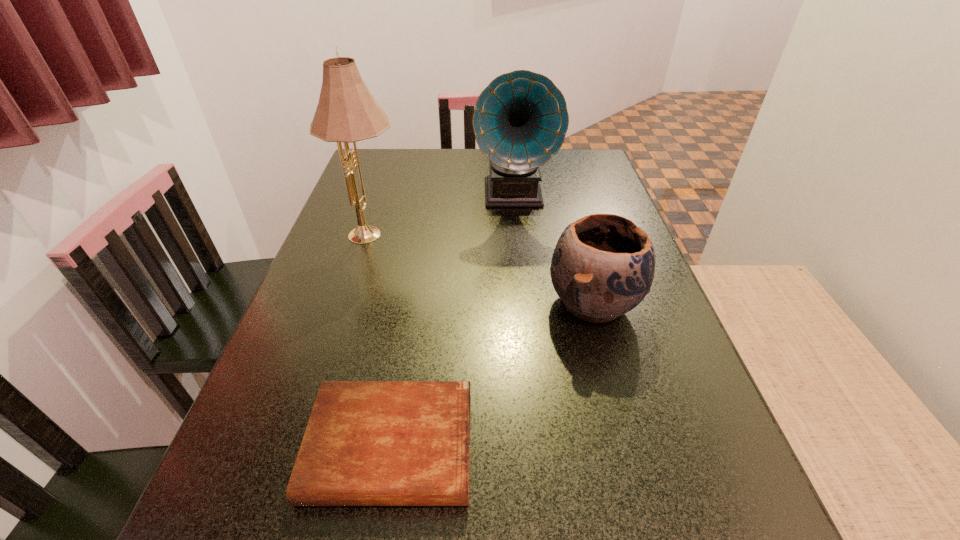
Identify the location of free space that satisfies the following two spatial constraints: 1. on the front side of the second shortest object; 2. on the right side of the lampshade. The width and height of the screenshot is (960, 540). 349,303.

The height and width of the screenshot is (540, 960). I want to click on vacant position in the image that satisfies the following two spatial constraints: 1. from the horn of the pottery; 2. on the right side of the third shortest object, so click(x=525, y=303).

Where is `free region that satisfies the following two spatial constraints: 1. from the horn of the pottery; 2. on the right side of the third shortest object`? The width and height of the screenshot is (960, 540). free region that satisfies the following two spatial constraints: 1. from the horn of the pottery; 2. on the right side of the third shortest object is located at coordinates (525, 303).